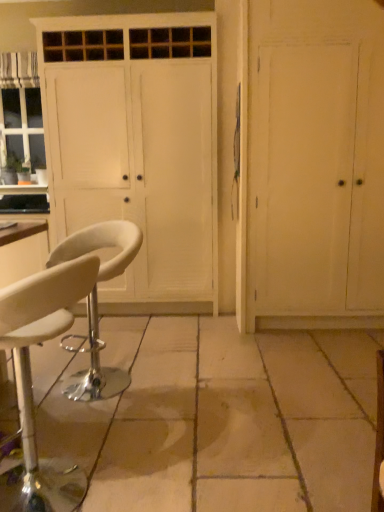
You are a GUI agent. You are given a task and a screenshot of the screen. Output one action in this format:
    pyautogui.click(x=<x>, y=<y>)
    Task: Click on the white leather stool at lower left, the second chair from the front
    The width and height of the screenshot is (384, 512).
    Given the screenshot: What is the action you would take?
    pyautogui.click(x=101, y=246)

Describe the element at coordinates (101, 246) in the screenshot. Image resolution: width=384 pixels, height=512 pixels. I see `white leather stool at lower left, the first chair when ordered from back to front` at that location.

What do you see at coordinates (224, 419) in the screenshot?
I see `beige stone floor at center` at bounding box center [224, 419].

The image size is (384, 512). Find the location of `white wood door at right`. white wood door at right is located at coordinates (311, 165).

Does white leather stool at lower left, the first chair when ordered from back to front, have a smaller size compared to white leather stool at lower left, placed as the 1th chair when sorted from front to back?

No.

Is white leather stool at lower left, the first chair when ordered from back to front, shorter than white leather stool at lower left, the second chair from the back?

Indeed, white leather stool at lower left, the first chair when ordered from back to front, has a lesser height compared to white leather stool at lower left, the second chair from the back.

Can you see white leather stool at lower left, the first chair when ordered from back to front, touching white leather stool at lower left, the second chair from the back?

white leather stool at lower left, the first chair when ordered from back to front, and white leather stool at lower left, the second chair from the back, are clearly separated.

From the image's perspective, is white wood cabinet at center below white leather stool at lower left, the second chair from the back?

No, from the image's perspective, white wood cabinet at center is not beneath white leather stool at lower left, the second chair from the back.

Measure the distance between white wood cabinet at center and white leather stool at lower left, placed as the 1th chair when sorted from front to back.

white wood cabinet at center and white leather stool at lower left, placed as the 1th chair when sorted from front to back, are 2.02 meters apart.

From the picture: Is white wood cabinet at center positioned beyond the bounds of white leather stool at lower left, the second chair from the back?

Absolutely, white wood cabinet at center is external to white leather stool at lower left, the second chair from the back.

Between white wood cabinet at center and white leather stool at lower left, placed as the 1th chair when sorted from front to back, which one has larger size?

white wood cabinet at center is bigger.

Consider the image. Measure the distance between white leather stool at lower left, the second chair from the front, and white wood cabinet at center.

They are 1.42 meters apart.

Which is behind, white leather stool at lower left, the first chair when ordered from back to front, or white wood cabinet at center?

Positioned behind is white wood cabinet at center.

From a real-world perspective, which is physically above, white leather stool at lower left, the first chair when ordered from back to front, or white wood cabinet at center?

In real-world perspective, white wood cabinet at center is above.

Is there a large distance between white leather stool at lower left, the second chair from the front, and white wood cabinet at center?

Yes, white leather stool at lower left, the second chair from the front, and white wood cabinet at center are quite far apart.

Consider the image. Considering the relative positions of white leather stool at lower left, placed as the 1th chair when sorted from front to back, and white wood door at right in the image provided, is white leather stool at lower left, placed as the 1th chair when sorted from front to back, in front of white wood door at right?

Yes, it is in front of white wood door at right.

How many degrees apart are the facing directions of white leather stool at lower left, placed as the 1th chair when sorted from front to back, and white wood door at right?

96 degrees.

Is white leather stool at lower left, the second chair from the back, directly adjacent to white wood door at right?

white leather stool at lower left, the second chair from the back, and white wood door at right are not in contact.

Is white leather stool at lower left, placed as the 1th chair when sorted from front to back, facing away from white wood door at right?

No, white leather stool at lower left, placed as the 1th chair when sorted from front to back,'s orientation is not away from white wood door at right.

Do you think white wood cabinet at center is within white leather stool at lower left, the second chair from the front, or outside of it?

white wood cabinet at center is located beyond the bounds of white leather stool at lower left, the second chair from the front.

Is white wood cabinet at center taller than white leather stool at lower left, the first chair when ordered from back to front?

Yes, white wood cabinet at center is taller than white leather stool at lower left, the first chair when ordered from back to front.

Find the location of a particular element. cabinetry that is above the white leather stool at lower left, the first chair when ordered from back to front (from a real-world perspective) is located at coordinates (137, 147).

Which of these two, white leather stool at lower left, the first chair when ordered from back to front, or beige stone floor at center, is wider?

Wider between the two is beige stone floor at center.

Who is shorter, white leather stool at lower left, the first chair when ordered from back to front, or beige stone floor at center?

With less height is beige stone floor at center.

Who is more distant, white leather stool at lower left, the first chair when ordered from back to front, or beige stone floor at center?

white leather stool at lower left, the first chair when ordered from back to front, is further from the camera.

How distant is beige stone floor at center from white wood door at right?

beige stone floor at center is 1.02 meters away from white wood door at right.

From the picture: Could you tell me if beige stone floor at center is turned towards white wood door at right?

No, beige stone floor at center does not turn towards white wood door at right.

Considering the sizes of objects beige stone floor at center and white wood door at right in the image provided, who is smaller, beige stone floor at center or white wood door at right?

beige stone floor at center is smaller.

Is beige stone floor at center at the left side of white wood door at right?

Correct, you'll find beige stone floor at center to the left of white wood door at right.

The width and height of the screenshot is (384, 512). Find the location of `chair behind the white leather stool at lower left, the second chair from the back`. chair behind the white leather stool at lower left, the second chair from the back is located at coordinates (101, 246).

From the image's perspective, count 2nd chairs downward from the white wood cabinet at center and point to it. Please provide its 2D coordinates.

[(31, 381)]

Which object lies nearer to the anchor point white wood cabinet at center, white wood door at right or beige stone floor at center?

white wood door at right lies closer to white wood cabinet at center than the other object.

Which object lies nearer to the anchor point white leather stool at lower left, the second chair from the back, beige stone floor at center or white wood door at right?

Among the two, beige stone floor at center is located nearer to white leather stool at lower left, the second chair from the back.

Considering their positions, is white leather stool at lower left, the second chair from the back, positioned closer to white leather stool at lower left, the second chair from the front, than white wood door at right?

white leather stool at lower left, the second chair from the back, is positioned closer to the anchor white leather stool at lower left, the second chair from the front.

From the image, which object appears to be farther from white wood door at right, white leather stool at lower left, the second chair from the front, or beige stone floor at center?

white leather stool at lower left, the second chair from the front, is further to white wood door at right.

Which object lies nearer to the anchor point white wood cabinet at center, beige stone floor at center or white wood door at right?

white wood door at right lies closer to white wood cabinet at center than the other object.

Which object lies further to the anchor point beige stone floor at center, white wood cabinet at center or white leather stool at lower left, placed as the 1th chair when sorted from front to back?

white wood cabinet at center is further to beige stone floor at center.

From the image, which object appears to be nearer to white wood door at right, white leather stool at lower left, the first chair when ordered from back to front, or white leather stool at lower left, placed as the 1th chair when sorted from front to back?

white leather stool at lower left, the first chair when ordered from back to front.

Based on their spatial positions, is beige stone floor at center or white wood cabinet at center closer to white wood door at right?

white wood cabinet at center lies closer to white wood door at right than the other object.

The width and height of the screenshot is (384, 512). In order to click on concrete between white leather stool at lower left, the second chair from the back, and white wood door at right from front to back in this screenshot , I will do `click(224, 419)`.

You are a GUI agent. You are given a task and a screenshot of the screen. Output one action in this format:
    pyautogui.click(x=<x>, y=<y>)
    Task: Click on the door between beige stone floor at center and white wood cabinet at center in the front-back direction
    The height and width of the screenshot is (512, 384).
    Given the screenshot: What is the action you would take?
    pyautogui.click(x=311, y=165)

Find the location of a particular element. cabinetry between white leather stool at lower left, the second chair from the front, and white wood door at right, in the horizontal direction is located at coordinates click(137, 147).

Find the location of a particular element. This screenshot has width=384, height=512. concrete between white leather stool at lower left, the second chair from the back, and white wood cabinet at center from front to back is located at coordinates (224, 419).